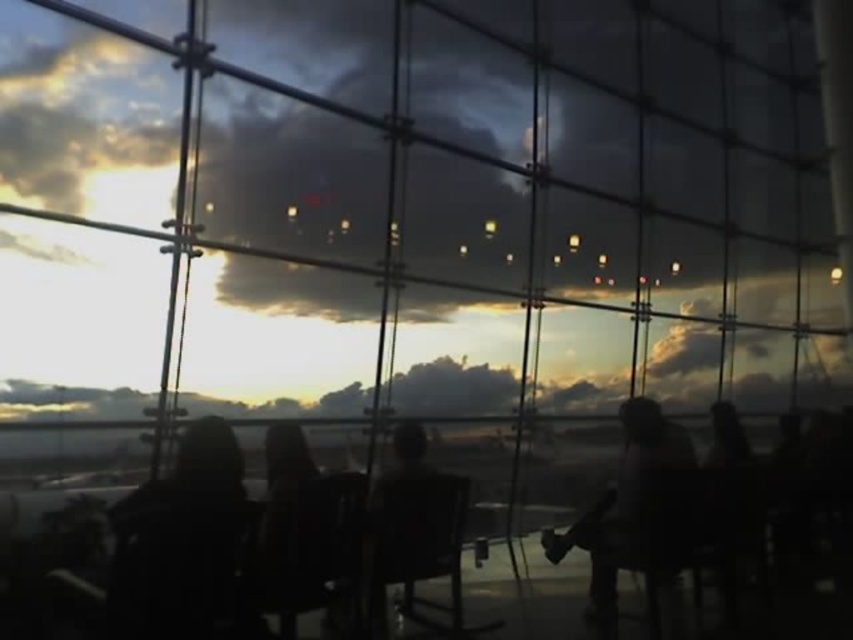
Question: Which point is closer to the camera taking this photo?

Choices:
 (A) (605, 561)
 (B) (212, 545)

Answer: (B)

Question: Is black matte jacket at left positioned at the back of silhouette figure at right?

Choices:
 (A) no
 (B) yes

Answer: (A)

Question: Can you confirm if black matte jacket at left is wider than silhouette figure at right?

Choices:
 (A) yes
 (B) no

Answer: (B)

Question: Which of the following is the closest to the observer?

Choices:
 (A) black matte jacket at left
 (B) silhouette figure at right

Answer: (A)

Question: Which point is closer to the camera taking this photo?

Choices:
 (A) (x=125, y=580)
 (B) (x=611, y=552)

Answer: (A)

Question: Is black matte jacket at left bigger than silhouette figure at right?

Choices:
 (A) yes
 (B) no

Answer: (B)